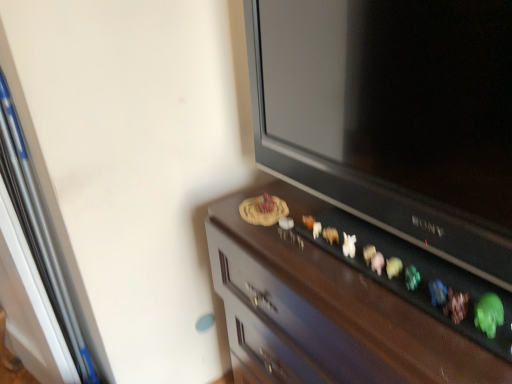
Locate an element on the screen. This screenshot has width=512, height=384. wooden cabinet at center is located at coordinates (324, 311).

Image resolution: width=512 pixels, height=384 pixels. What do you see at coordinates (324, 311) in the screenshot?
I see `wooden cabinet at center` at bounding box center [324, 311].

I want to click on matte black television at upper right, so pyautogui.click(x=394, y=116).

This screenshot has width=512, height=384. What do you see at coordinates (394, 116) in the screenshot? I see `matte black television at upper right` at bounding box center [394, 116].

Find the location of a particular element. The width and height of the screenshot is (512, 384). wooden cabinet at center is located at coordinates (324, 311).

Which is more to the right, matte black television at upper right or wooden cabinet at center?

wooden cabinet at center is more to the right.

Considering the positions of objects matte black television at upper right and wooden cabinet at center in the image provided, who is behind, matte black television at upper right or wooden cabinet at center?

wooden cabinet at center is behind.

Which is farther from the camera, [303,157] or [263,361]?

The point [263,361] is farther from the camera.

From the image's perspective, is matte black television at upper right located above or below wooden cabinet at center?

Clearly, from the image's perspective, matte black television at upper right is above wooden cabinet at center.

From a real-world perspective, is matte black television at upper right physically located above or below wooden cabinet at center?

Answer: In terms of real-world spatial position, matte black television at upper right is above wooden cabinet at center.

Between matte black television at upper right and wooden cabinet at center, which one has smaller width?

matte black television at upper right is thinner.

Based on the photo, considering the relative sizes of matte black television at upper right and wooden cabinet at center in the image provided, is matte black television at upper right shorter than wooden cabinet at center?

Correct, matte black television at upper right is not as tall as wooden cabinet at center.

Between matte black television at upper right and wooden cabinet at center, which one has larger size?

wooden cabinet at center is bigger.

Is matte black television at upper right outside of wooden cabinet at center?

matte black television at upper right is positioned outside wooden cabinet at center.

Would you consider matte black television at upper right to be distant from wooden cabinet at center?

No.

Could you tell me if matte black television at upper right is facing wooden cabinet at center?

No.

Locate an element on the screen. furniture to the right of matte black television at upper right is located at coordinates (324, 311).

Would you say wooden cabinet at center is to the left or to the right of matte black television at upper right in the picture?

From the image, it's evident that wooden cabinet at center is to the right of matte black television at upper right.

Looking at this image, is wooden cabinet at center closer to the viewer compared to matte black television at upper right?

That is False.

Is point (311, 319) less distant than point (450, 65)?

No.

From the image's perspective, does wooden cabinet at center appear higher than matte black television at upper right?

No.

Consider the image. From a real-world perspective, is wooden cabinet at center over matte black television at upper right?

No.

Based on the photo, which of these two, wooden cabinet at center or matte black television at upper right, is thinner?

matte black television at upper right is thinner.

Considering the relative sizes of wooden cabinet at center and matte black television at upper right in the image provided, is wooden cabinet at center taller than matte black television at upper right?

Yes.

Based on their sizes in the image, would you say wooden cabinet at center is bigger or smaller than matte black television at upper right?

Considering their sizes, wooden cabinet at center takes up more space than matte black television at upper right.

Do you think wooden cabinet at center is within matte black television at upper right, or outside of it?

wooden cabinet at center is outside matte black television at upper right.

Is wooden cabinet at center next to matte black television at upper right and touching it?

They are not placed beside each other.

Could you tell me if wooden cabinet at center is turned towards matte black television at upper right?

No, wooden cabinet at center is not turned towards matte black television at upper right.

What's the angular difference between wooden cabinet at center and matte black television at upper right's facing directions?

The angle between the facing direction of wooden cabinet at center and the facing direction of matte black television at upper right is 1.11 degrees.

Measure the distance between wooden cabinet at center and matte black television at upper right.

8.96 inches.

I want to click on furniture located underneath the matte black television at upper right (from a real-world perspective), so click(x=324, y=311).

I want to click on furniture to the right of matte black television at upper right, so click(x=324, y=311).

This screenshot has height=384, width=512. I want to click on furniture that is under the matte black television at upper right (from a real-world perspective), so click(324, 311).